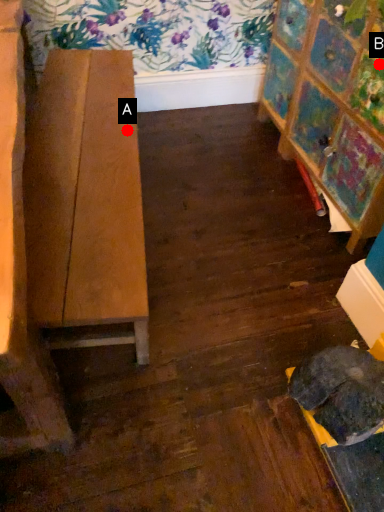
Question: Two points are circled on the image, labeled by A and B beside each circle. Which point is closer to the camera taking this photo?

Choices:
 (A) A is closer
 (B) B is closer

Answer: (B)